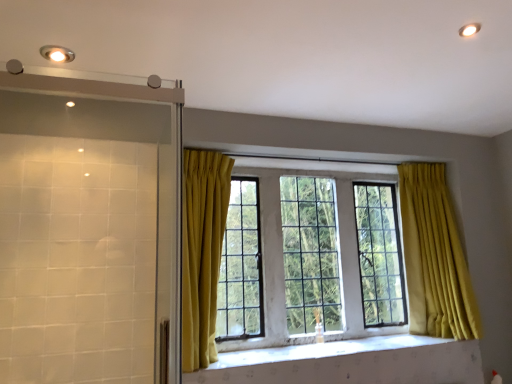
Locate an element on the screen. The image size is (512, 384). vacant area on the back side of matte silver light fixture at upper left is located at coordinates (84, 73).